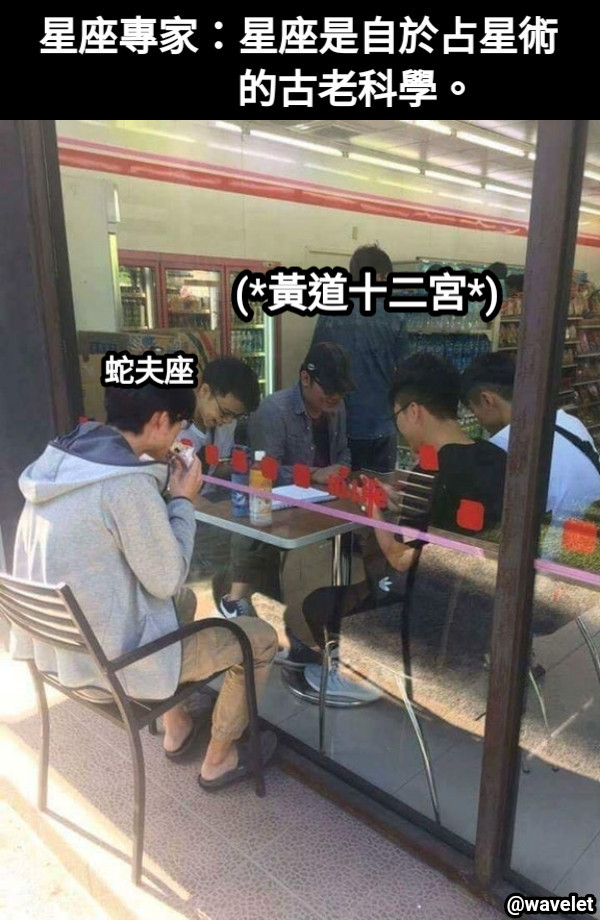
This screenshot has height=920, width=600. What are the coordinates of `table` in the screenshot? It's located at (286, 526).